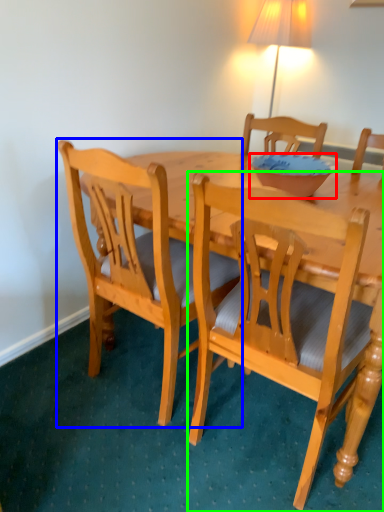
Question: Which is nearer to the bowl (highlighted by a red box)? chair (highlighted by a blue box) or chair (highlighted by a green box).

Choices:
 (A) chair
 (B) chair

Answer: (B)